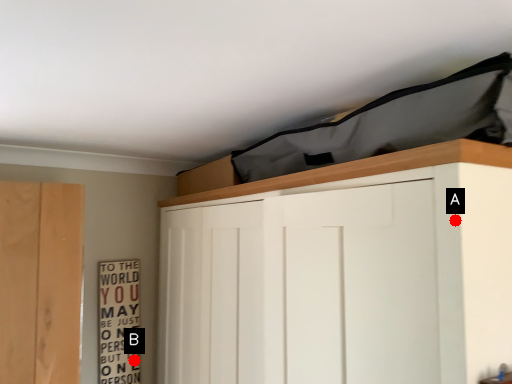
Question: Two points are circled on the image, labeled by A and B beside each circle. Which point is farther from the camera taking this photo?

Choices:
 (A) A is further
 (B) B is further

Answer: (B)